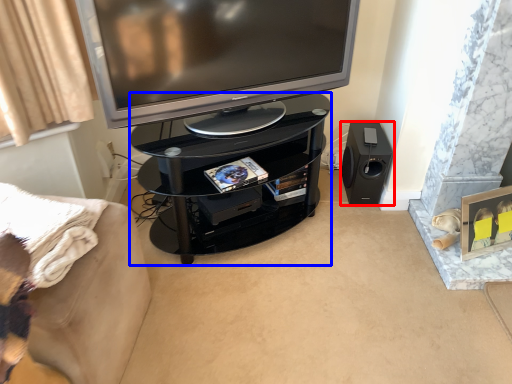
Question: Among these objects, which one is nearest to the camera, loudspeaker (highlighted by a red box) or tv cabinet (highlighted by a blue box)?

Choices:
 (A) loudspeaker
 (B) tv cabinet

Answer: (B)